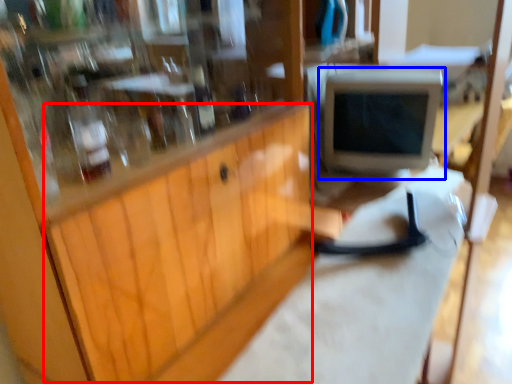
Question: Which object appears closest to the camera in this image, wood (highlighted by a red box) or computer monitor (highlighted by a blue box)?

Choices:
 (A) wood
 (B) computer monitor

Answer: (A)